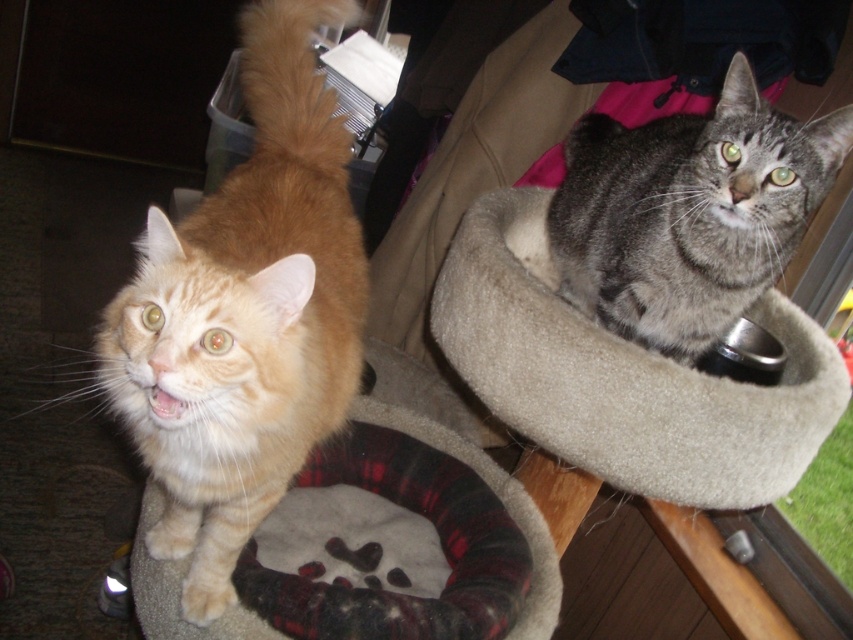
Who is taller, orange fur cat at left or gray tabby cat at upper right?

orange fur cat at left is taller.

Can you confirm if orange fur cat at left is shorter than gray tabby cat at upper right?

No.

You are a GUI agent. You are given a task and a screenshot of the screen. Output one action in this format:
    pyautogui.click(x=<x>, y=<y>)
    Task: Click on the orange fur cat at left
    The image size is (853, 640).
    Given the screenshot: What is the action you would take?
    click(x=244, y=314)

Looking at this image, who is more distant from viewer, (x=817, y=186) or (x=509, y=512)?

Point (x=509, y=512)

Can you confirm if gray tabby cat at upper right is thinner than plaid fabric cat bed at center?

Yes, gray tabby cat at upper right is thinner than plaid fabric cat bed at center.

What do you see at coordinates (688, 212) in the screenshot? The width and height of the screenshot is (853, 640). I see `gray tabby cat at upper right` at bounding box center [688, 212].

Where is `gray tabby cat at upper right`? gray tabby cat at upper right is located at coordinates (688, 212).

Does beige soft cat bed at upper right appear on the left side of plaid fabric cat bed at center?

In fact, beige soft cat bed at upper right is to the right of plaid fabric cat bed at center.

Which is behind, point (514, 211) or point (558, 602)?

The point (514, 211) is more distant.

The image size is (853, 640). I want to click on beige soft cat bed at upper right, so click(624, 374).